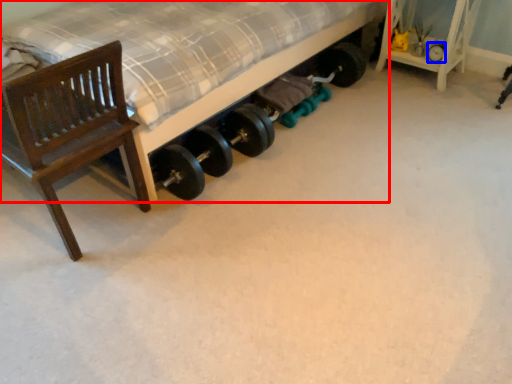
Question: Which object is further to the camera taking this photo, bed (highlighted by a red box) or tire (highlighted by a blue box)?

Choices:
 (A) bed
 (B) tire

Answer: (B)